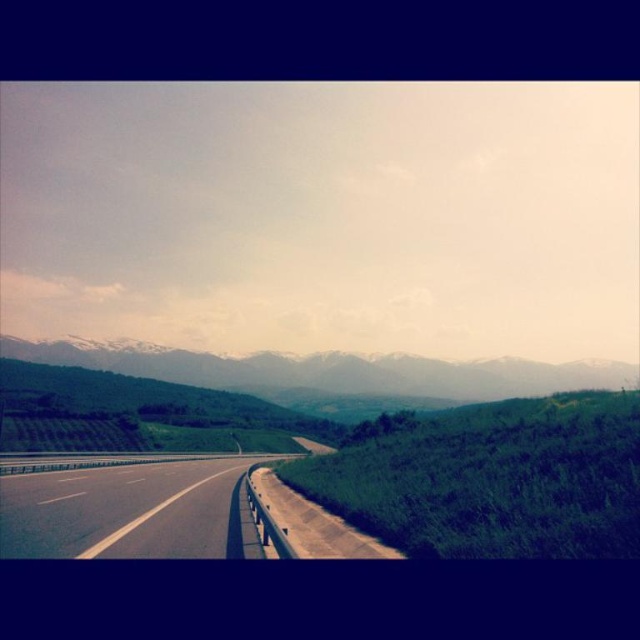
From the picture: Can you confirm if green grassy hill at right is thinner than black asphalt highway at center?

Yes, green grassy hill at right is thinner than black asphalt highway at center.

Locate an element on the screen. This screenshot has height=640, width=640. green grassy hill at right is located at coordinates (490, 477).

Identify the location of green grassy hill at right. (490, 477).

You are a GUI agent. You are given a task and a screenshot of the screen. Output one action in this format:
    pyautogui.click(x=<x>, y=<y>)
    Task: Click on the green grassy hill at right
    The height and width of the screenshot is (640, 640).
    Given the screenshot: What is the action you would take?
    (x=490, y=477)

Consider the image. Is green grassy hill at right bigger than snowy rock mountain at upper center?

No, green grassy hill at right is not bigger than snowy rock mountain at upper center.

What do you see at coordinates (490, 477) in the screenshot?
I see `green grassy hill at right` at bounding box center [490, 477].

Find the location of a particular element. green grassy hill at right is located at coordinates (490, 477).

Is snowy rock mountain at upper center wider than black asphalt highway at center?

Yes.

Does snowy rock mountain at upper center come behind black asphalt highway at center?

Yes, it is behind black asphalt highway at center.

Identify the location of snowy rock mountain at upper center. (330, 371).